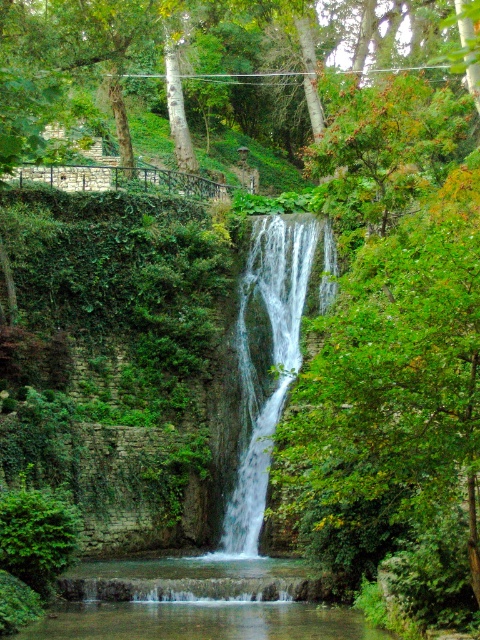
Is green leafy tree at upper center closer to camera compared to white frothy water at center?

No, it is not.

Can you confirm if green leafy tree at upper center is positioned below white frothy water at center?

No, green leafy tree at upper center is not below white frothy water at center.

The height and width of the screenshot is (640, 480). I want to click on green leafy tree at upper center, so click(196, 61).

Is point (204, 113) behind point (222, 576)?

Yes.

Is green leafy tree at upper center above clear water at center?

Correct, green leafy tree at upper center is located above clear water at center.

Find the location of a particular element. This screenshot has height=640, width=480. green leafy tree at upper center is located at coordinates (196, 61).

At what (x,y) coordinates should I click in order to perform the action: click on green leafy tree at upper center. Please return your answer as a coordinate pair (x, y). This screenshot has height=640, width=480. Looking at the image, I should click on (196, 61).

Does point (98, 582) come farther from viewer compared to point (266, 420)?

No.

Looking at this image, is clear water at center taller than white frothy water at center?

No.

Describe the element at coordinates (196, 602) in the screenshot. I see `clear water at center` at that location.

You are a GUI agent. You are given a task and a screenshot of the screen. Output one action in this format:
    pyautogui.click(x=<x>, y=<y>)
    Task: Click on the clear water at center
    This screenshot has width=480, height=640.
    Given the screenshot: What is the action you would take?
    pyautogui.click(x=196, y=602)